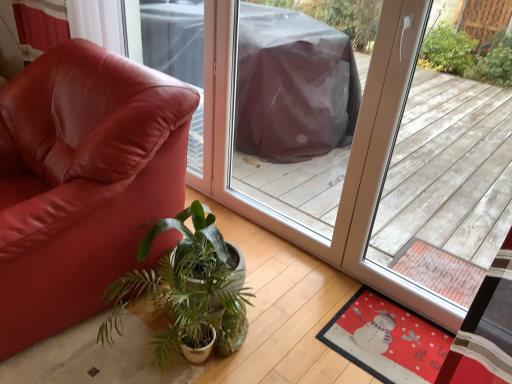
Question: Does matte leather chair at left have a greater width compared to green leafy plant at center?

Choices:
 (A) yes
 (B) no

Answer: (A)

Question: Is matte leather chair at left at the right side of green leafy plant at center?

Choices:
 (A) no
 (B) yes

Answer: (A)

Question: Is green leafy plant at center at the back of matte leather chair at left?

Choices:
 (A) no
 (B) yes

Answer: (A)

Question: Is matte leather chair at left further to camera compared to green leafy plant at center?

Choices:
 (A) no
 (B) yes

Answer: (A)

Question: Can we say matte leather chair at left lies outside green leafy plant at center?

Choices:
 (A) yes
 (B) no

Answer: (A)

Question: Considering the relative sizes of matte leather chair at left and green leafy plant at center in the image provided, is matte leather chair at left bigger than green leafy plant at center?

Choices:
 (A) yes
 (B) no

Answer: (A)

Question: Does green leafy plant at center have a smaller size compared to red felt mat at lower right?

Choices:
 (A) yes
 (B) no

Answer: (B)

Question: Does green leafy plant at center touch red felt mat at lower right?

Choices:
 (A) no
 (B) yes

Answer: (A)

Question: From the image's perspective, is green leafy plant at center under red felt mat at lower right?

Choices:
 (A) no
 (B) yes

Answer: (A)

Question: Is green leafy plant at center taller than red felt mat at lower right?

Choices:
 (A) yes
 (B) no

Answer: (A)

Question: Is green leafy plant at center turned away from red felt mat at lower right?

Choices:
 (A) no
 (B) yes

Answer: (A)

Question: From the image's perspective, is green leafy plant at center on red felt mat at lower right?

Choices:
 (A) no
 (B) yes

Answer: (B)

Question: Does matte leather chair at left have a smaller size compared to red felt mat at lower right?

Choices:
 (A) yes
 (B) no

Answer: (B)